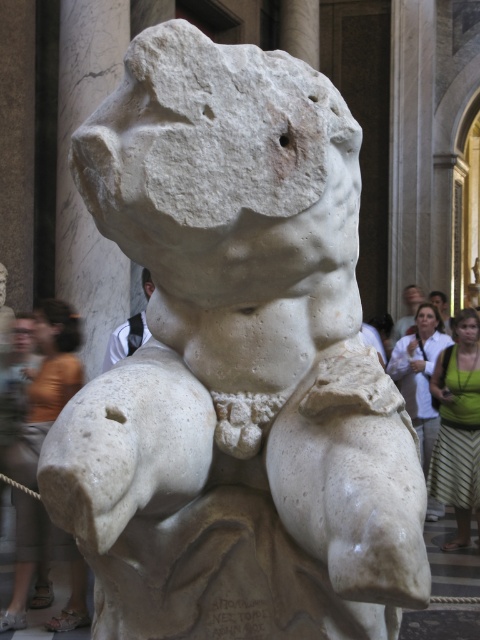
Question: Can you confirm if orange fabric at lower left is smaller than green fabric skirt at lower right?

Choices:
 (A) yes
 (B) no

Answer: (A)

Question: Does orange fabric at lower left appear over white shirt at center?

Choices:
 (A) yes
 (B) no

Answer: (B)

Question: Where is green fabric skirt at lower right located in relation to light brown hair at upper center in the image?

Choices:
 (A) right
 (B) left

Answer: (B)

Question: Which point is farther from the camera taking this photo?

Choices:
 (A) (445, 330)
 (B) (121, 342)

Answer: (A)

Question: Considering the real-world distances, which object is farthest from the green fabric dress at right?

Choices:
 (A) white shirt at center
 (B) green fabric skirt at lower right

Answer: (A)

Question: Which of these objects is positioned farthest from the orange fabric at lower left?

Choices:
 (A) green fabric skirt at lower right
 (B) light brown hair at upper center

Answer: (B)